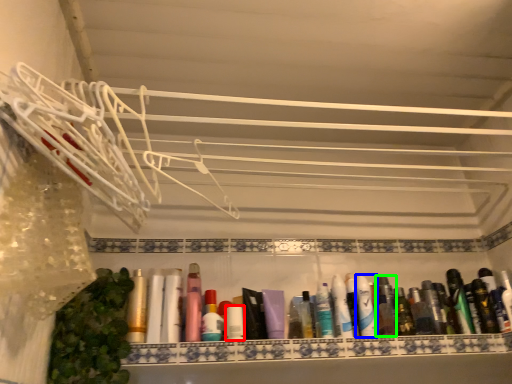
Question: Which object is positioned farthest from toiletry (highlighted by a red box)? Select from toothpaste (highlighted by a blue box) and toiletry (highlighted by a green box).

Choices:
 (A) toothpaste
 (B) toiletry

Answer: (B)